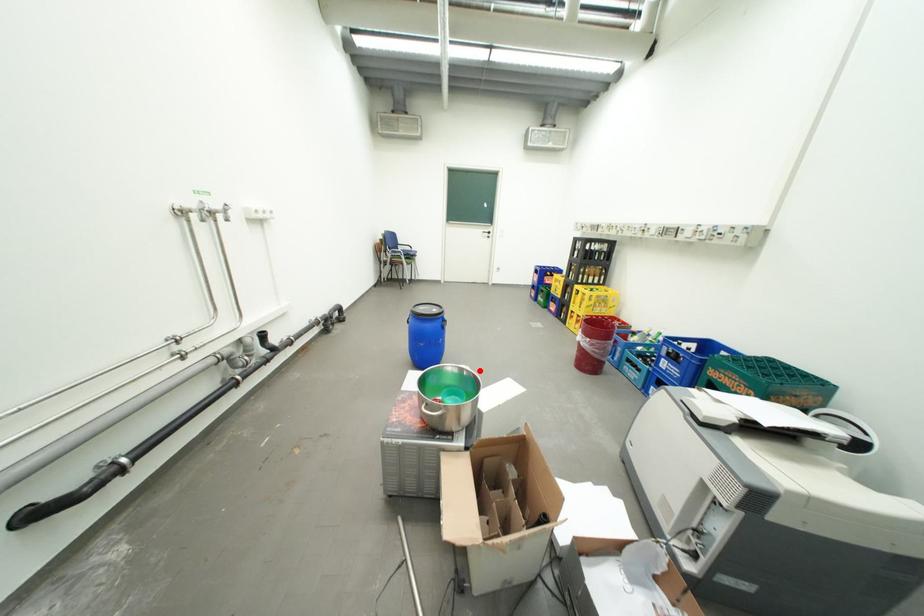
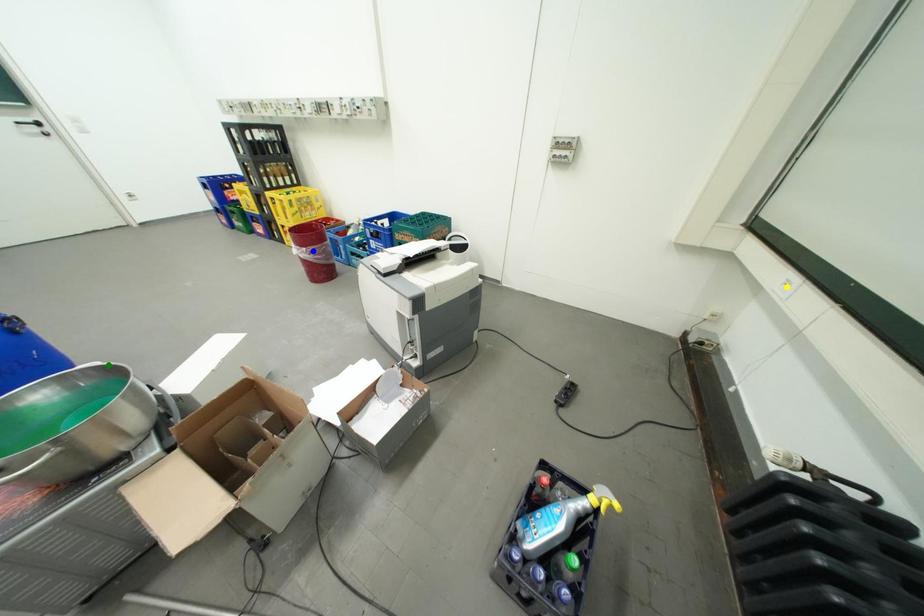
Question: I am providing you with two images of the same scene from different viewpoints. A red point is marked on the first image. You are given multiple points on the second image. Which point in image 2 is actually the same real-world point as the red point in image 1?

Choices:
 (A) green point
 (B) yellow point
 (C) blue point

Answer: (A)